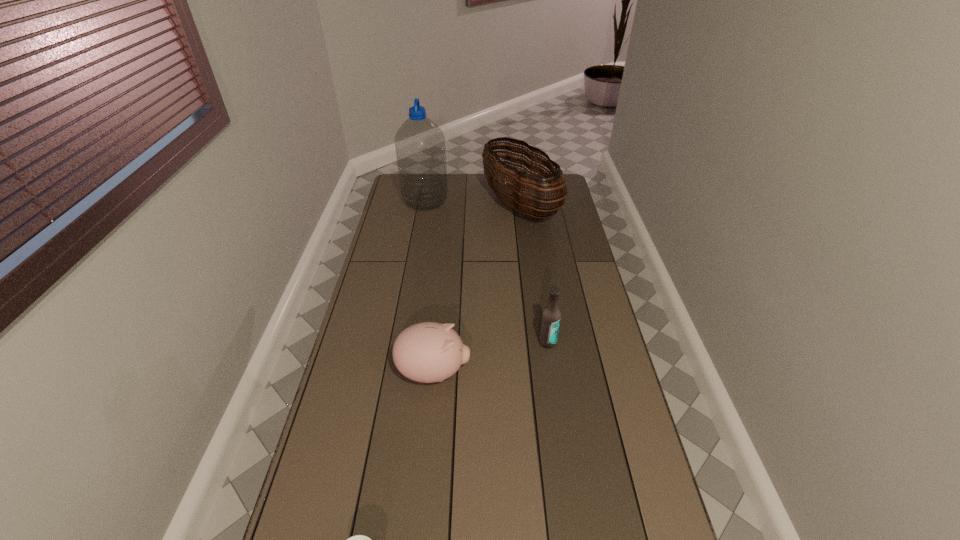
This screenshot has height=540, width=960. Identify the location of empty space between the tallest object and the beer bottle. (487, 272).

Find the location of a particular element. The image size is (960, 540). the fourth closest object to the basket is located at coordinates (358, 539).

Find the location of `the third closest object to the nearest object`. the third closest object to the nearest object is located at coordinates (523, 199).

I want to click on vacant space that satisfies the following two spatial constraints: 1. on the side of the beer bottle with the label; 2. at the snout of the piggy bank, so click(x=552, y=373).